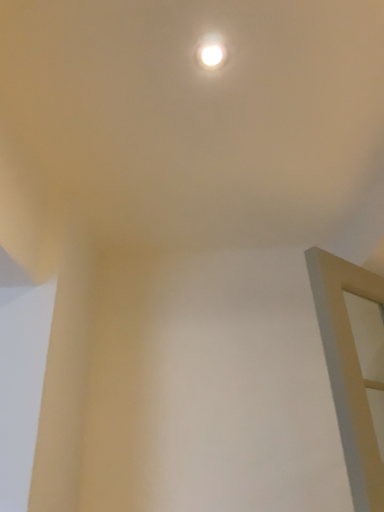
The width and height of the screenshot is (384, 512). What do you see at coordinates (212, 52) in the screenshot? I see `white glossy droplight at upper center` at bounding box center [212, 52].

Identify the location of white glossy droplight at upper center. The image size is (384, 512). (212, 52).

What are the coordinates of `white glossy droplight at upper center` in the screenshot? It's located at (212, 52).